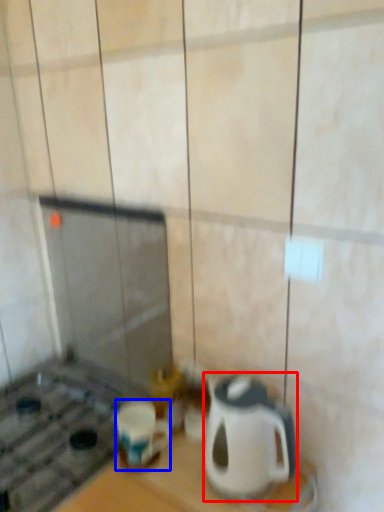
Question: Which of the following is the farthest to the observer, kitchen appliance (highlighted by a red box) or coffee cup (highlighted by a blue box)?

Choices:
 (A) kitchen appliance
 (B) coffee cup

Answer: (B)